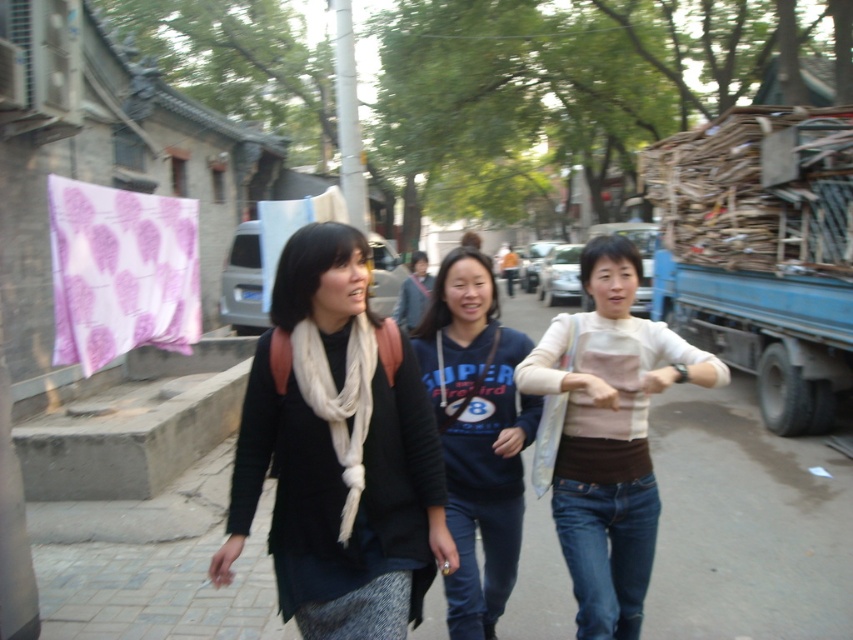
You are a photographer trying to capture the matte black scarf at center in your shot. The camera has a focus point at coordinates 0.708, 0.399. Is the scarf positioned correctly to be in focus?

Yes, the matte black scarf at center is positioned exactly at the focus point coordinates (339,452), so it will be in focus.

What is located at the coordinates point (339, 452)?

The matte black scarf at center is located at point (339, 452).

You are a pedestrian standing on the sidewalk and see the blue cotton hoodie at center and the blue metallic truck at right. Which object is closer to you?

The blue cotton hoodie at center is closer to you since it is in front of the blue metallic truck at right.